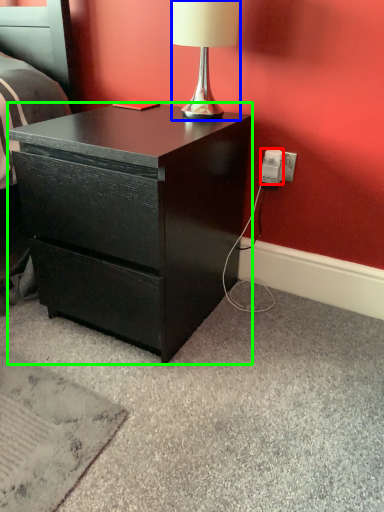
Question: Based on their relative distances, which object is nearer to power outlet (highlighted by a red box)? Choose from lamp (highlighted by a blue box) and desk (highlighted by a green box).

Choices:
 (A) lamp
 (B) desk

Answer: (A)